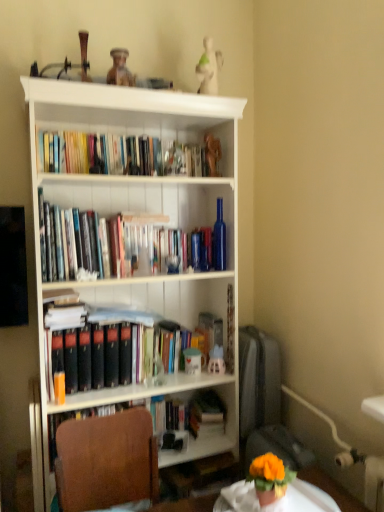
Locate an element on the screen. Image resolution: width=384 pixels, height=512 pixels. white matte bookcase at center is located at coordinates (144, 223).

In order to face matte blue toy at center, which ranks as the second toy in top-to-bottom order, should I rotate leftwards or rightwards?

Rotate right and turn 3.245 degrees.

What do you see at coordinates (106, 461) in the screenshot?
I see `brown fabric chair at lower left` at bounding box center [106, 461].

Locate an element on the screen. The image size is (384, 512). white matte bookcase at center is located at coordinates (144, 223).

From the image's perspective, who appears lower, orange matte flower pot at lower right or brown fabric chair at lower left?

From the image's view, brown fabric chair at lower left is below.

Which is more to the left, orange matte flower pot at lower right or brown fabric chair at lower left?

brown fabric chair at lower left is more to the left.

How different are the orientations of orange matte flower pot at lower right and brown fabric chair at lower left in degrees?

They differ by 84.6 degrees in their facing directions.

Considering the positions of point (266, 493) and point (137, 498), is point (266, 493) closer or farther from the camera than point (137, 498)?

Clearly, point (266, 493) is closer to the camera than point (137, 498).

Is white glossy round table at lower center positioned beyond the bounds of orange matte flower pot at lower right?

That's correct, white glossy round table at lower center is outside of orange matte flower pot at lower right.

Is white glossy round table at lower center shorter than orange matte flower pot at lower right?

Yes.

Is the position of white glossy round table at lower center less distant than that of orange matte flower pot at lower right?

Yes, white glossy round table at lower center is closer to the viewer.

Which object is wider, white glossy round table at lower center or orange matte flower pot at lower right?

white glossy round table at lower center is wider.

Is hardcover books at upper left not within blue glass bottle at center?

Yes.

Considering the positions of objects hardcover books at upper left and blue glass bottle at center in the image provided, who is behind, hardcover books at upper left or blue glass bottle at center?

blue glass bottle at center is further from the camera.

Could you tell me if hardcover books at upper left is facing blue glass bottle at center?

No, hardcover books at upper left is not aimed at blue glass bottle at center.

Considering their positions, is matte orange paperback book at left located in front of or behind orange matte flower pot at lower right?

Clearly, matte orange paperback book at left is behind orange matte flower pot at lower right.

Where is `houseplant in front of the matte orange paperback book at left`? houseplant in front of the matte orange paperback book at left is located at coordinates tap(270, 478).

From a real-world perspective, does matte orange paperback book at left stand above orange matte flower pot at lower right?

Yes, from a real-world perspective, matte orange paperback book at left is over orange matte flower pot at lower right

Looking at their sizes, would you say blue glass bottle at center is wider or thinner than hardcover books at upper left?

Considering their sizes, blue glass bottle at center looks slimmer than hardcover books at upper left.

Is the depth of blue glass bottle at center less than that of hardcover books at upper left?

That is False.

From the image's perspective, between blue glass bottle at center and hardcover books at upper left, who is located below?

blue glass bottle at center is shown below in the image.

From a real-world perspective, which is physically above, blue glass bottle at center or hardcover books at upper left?

hardcover books at upper left, from a real-world perspective.

Consider the image. Which object is positioned more to the right, blue glass bottle at center or brown fabric chair at lower left?

From the viewer's perspective, blue glass bottle at center appears more on the right side.

Is blue glass bottle at center taller than brown fabric chair at lower left?

In fact, blue glass bottle at center may be shorter than brown fabric chair at lower left.

Which is nearer, (215, 263) or (60, 484)?

Point (215, 263) is farther from the camera than point (60, 484).

Does orange matte flower pot at lower right lie in front of gold metallic figurine at upper center, arranged as the 2th toy when ordered from the bottom?

Yes, it is in front of gold metallic figurine at upper center, arranged as the 2th toy when ordered from the bottom.

Can you confirm if orange matte flower pot at lower right is positioned to the left of gold metallic figurine at upper center, arranged as the 2th toy when ordered from the bottom?

No, orange matte flower pot at lower right is not to the left of gold metallic figurine at upper center, arranged as the 2th toy when ordered from the bottom.

Is gold metallic figurine at upper center, the first toy in the top-to-bottom sequence, at the back of orange matte flower pot at lower right?

No, orange matte flower pot at lower right is not facing away from gold metallic figurine at upper center, the first toy in the top-to-bottom sequence.

Is orange matte flower pot at lower right positioned beyond the bounds of gold metallic figurine at upper center, the first toy in the top-to-bottom sequence?

That's correct, orange matte flower pot at lower right is outside of gold metallic figurine at upper center, the first toy in the top-to-bottom sequence.

Identify the location of chair in front of the orange matte flower pot at lower right. The height and width of the screenshot is (512, 384). (106, 461).

This screenshot has width=384, height=512. Find the location of `houseplant on the left side of white glossy round table at lower center`. houseplant on the left side of white glossy round table at lower center is located at coordinates (270, 478).

From the image, which object appears to be farther from brown fabric chair at lower left, gold metallic figurine at upper center, the first toy in the top-to-bottom sequence, or orange matte flower pot at lower right?

gold metallic figurine at upper center, the first toy in the top-to-bottom sequence, is further to brown fabric chair at lower left.

Which object lies further to the anchor point white glossy round table at lower center, hardcover books at upper left or matte orange paperback book at left?

hardcover books at upper left is further to white glossy round table at lower center.

Estimate the real-world distances between objects in this image. Which object is further from white matte bookcase at center, hardcover books at upper left or brown fabric chair at lower left?

brown fabric chair at lower left.

Looking at the image, which one is located closer to orange matte flower pot at lower right, white glossy round table at lower center or hardcover books at upper left?

Based on the image, white glossy round table at lower center appears to be nearer to orange matte flower pot at lower right.

Which object lies nearer to the anchor point brown fabric chair at lower left, matte blue toy at center, placed as the first toy when sorted from bottom to top, or gold metallic figurine at upper center, the first toy in the top-to-bottom sequence?

Among the two, matte blue toy at center, placed as the first toy when sorted from bottom to top, is located nearer to brown fabric chair at lower left.

From the picture: Estimate the real-world distances between objects in this image. Which object is further from matte blue toy at center, placed as the first toy when sorted from bottom to top, blue glass bottle at center or orange matte flower pot at lower right?

orange matte flower pot at lower right.

Estimate the real-world distances between objects in this image. Which object is further from hardcover books at upper left, white matte bookcase at center or white glossy round table at lower center?

white glossy round table at lower center is positioned further to the anchor hardcover books at upper left.

Based on their spatial positions, is white glossy round table at lower center or gold metallic figurine at upper center, arranged as the 2th toy when ordered from the bottom, further from hardcover books at upper left?

white glossy round table at lower center lies further to hardcover books at upper left than the other object.

Where is `bookcase that lies between gold metallic figurine at upper center, the first toy in the top-to-bottom sequence, and matte blue toy at center, which ranks as the second toy in top-to-bottom order, from top to bottom`? Image resolution: width=384 pixels, height=512 pixels. bookcase that lies between gold metallic figurine at upper center, the first toy in the top-to-bottom sequence, and matte blue toy at center, which ranks as the second toy in top-to-bottom order, from top to bottom is located at coordinates (144, 223).

Locate an element on the screen. The height and width of the screenshot is (512, 384). paperback book between gold metallic figurine at upper center, arranged as the 2th toy when ordered from the bottom, and brown fabric chair at lower left from top to bottom is located at coordinates (58, 367).

Identify the location of bottle between hardcover books at upper left and white matte bookcase at center vertically. Image resolution: width=384 pixels, height=512 pixels. (219, 239).

Where is `bookcase between blue glass bottle at center and brown fabric chair at lower left from top to bottom`? bookcase between blue glass bottle at center and brown fabric chair at lower left from top to bottom is located at coordinates (144, 223).